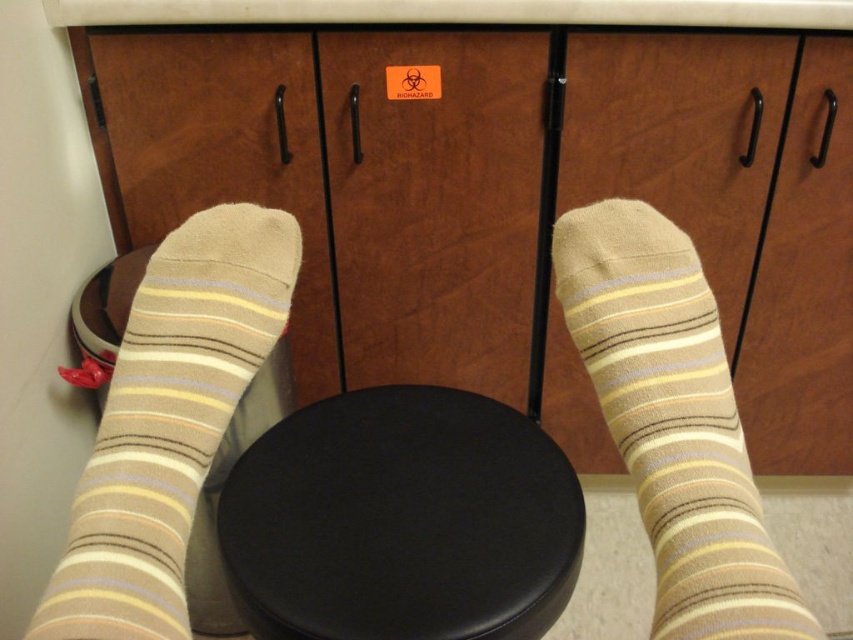
Question: Which point is farther to the camera?

Choices:
 (A) black leather stool at center
 (B) tan striped sock at center

Answer: (A)

Question: Does black leather stool at center appear on the right side of tan striped sock at lower left?

Choices:
 (A) no
 (B) yes

Answer: (B)

Question: Can you confirm if black leather stool at center is wider than tan striped sock at lower left?

Choices:
 (A) no
 (B) yes

Answer: (B)

Question: Is black leather stool at center in front of tan striped sock at lower left?

Choices:
 (A) yes
 (B) no

Answer: (B)

Question: Which of the following is the farthest from the observer?

Choices:
 (A) (218, 541)
 (B) (589, 353)
 (C) (299, 234)

Answer: (A)

Question: Which of these objects is positioned farthest from the tan striped sock at lower left?

Choices:
 (A) tan striped sock at center
 (B) black leather stool at center

Answer: (A)